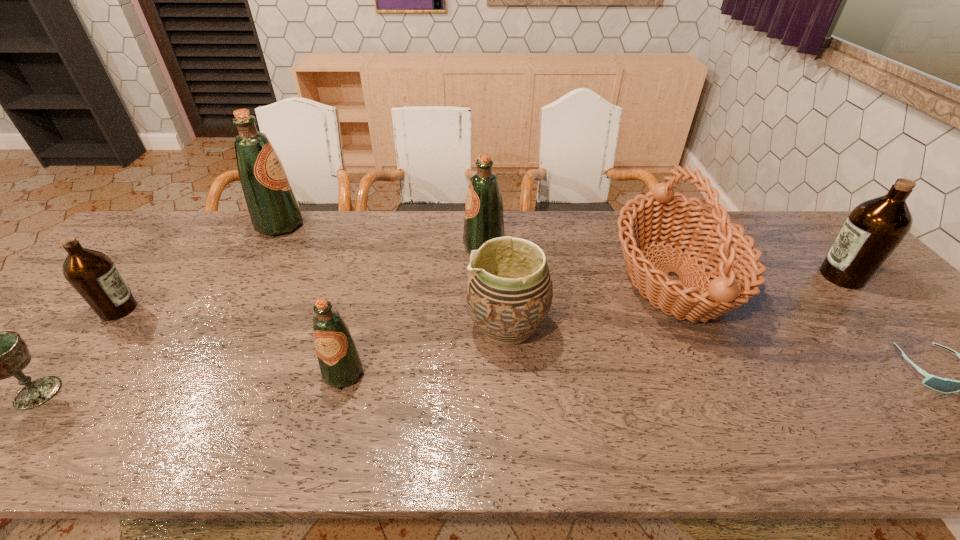
You are a GUI agent. You are given a task and a screenshot of the screen. Output one action in this format:
    pyautogui.click(x=<x>, y=<y>)
    Task: Click on the nearest olive oil
    
    Given the screenshot: What is the action you would take?
    pyautogui.click(x=339, y=360)

Identify the location of the fourth farthest olive oil. The height and width of the screenshot is (540, 960). [x=91, y=273].

Image resolution: width=960 pixels, height=540 pixels. Identify the location of the leftmost olive oil. (91, 273).

Where is `vacant area situated 0.160m on the front-facing side of the tallest olive oil`? The width and height of the screenshot is (960, 540). vacant area situated 0.160m on the front-facing side of the tallest olive oil is located at coordinates (353, 225).

At what (x,y) coordinates should I click in order to perform the action: click on blank area located 0.110m on the right of the third object from right to left. Please return your answer as a coordinate pair (x, y). Looking at the image, I should click on (774, 279).

Identify the location of vacant space located 0.090m on the front-facing side of the fourth olive oil from left to right. This screenshot has width=960, height=540. (434, 247).

Identify the location of free space located 0.070m on the front-facing side of the fourth olive oil from left to right. Image resolution: width=960 pixels, height=540 pixels. (441, 247).

The height and width of the screenshot is (540, 960). In order to click on vacant space located on the front-facing side of the fourth olive oil from left to right in this screenshot , I will do `click(438, 247)`.

Identify the location of vacant position located 0.300m on the label of the right brown olive oil. This screenshot has height=540, width=960. (713, 276).

Where is `vacant area situated on the label of the right brown olive oil`? Image resolution: width=960 pixels, height=540 pixels. vacant area situated on the label of the right brown olive oil is located at coordinates (700, 276).